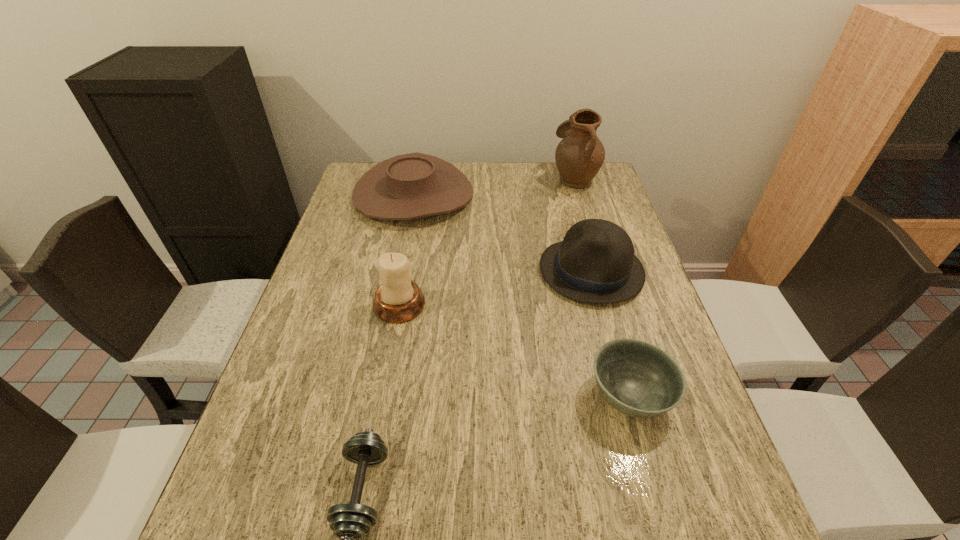
Locate an element on the screen. Image resolution: width=960 pixels, height=540 pixels. pitcher is located at coordinates (579, 156).

The height and width of the screenshot is (540, 960). What are the coordinates of `candle holder` in the screenshot? It's located at (398, 299).

The height and width of the screenshot is (540, 960). Find the location of `bowler hat`. bowler hat is located at coordinates (595, 263).

Identify the location of the fourth tallest object. (409, 186).

The width and height of the screenshot is (960, 540). Find the location of `bowl`. bowl is located at coordinates tap(637, 378).

Image resolution: width=960 pixels, height=540 pixels. In order to click on free location located at the spout of the tallest object in this screenshot , I will do `click(467, 179)`.

Locate an element on the screen. The height and width of the screenshot is (540, 960). free space located at the spout of the tallest object is located at coordinates (439, 179).

Locate an element on the screen. This screenshot has height=540, width=960. vacant space located at the spout of the tallest object is located at coordinates tap(449, 179).

The image size is (960, 540). What are the coordinates of `vacant space positioned 0.380m on the front of the candle holder` in the screenshot? It's located at (366, 485).

The image size is (960, 540). In order to click on vacant space located on the front-facing side of the bowler hat in this screenshot , I will do `click(422, 271)`.